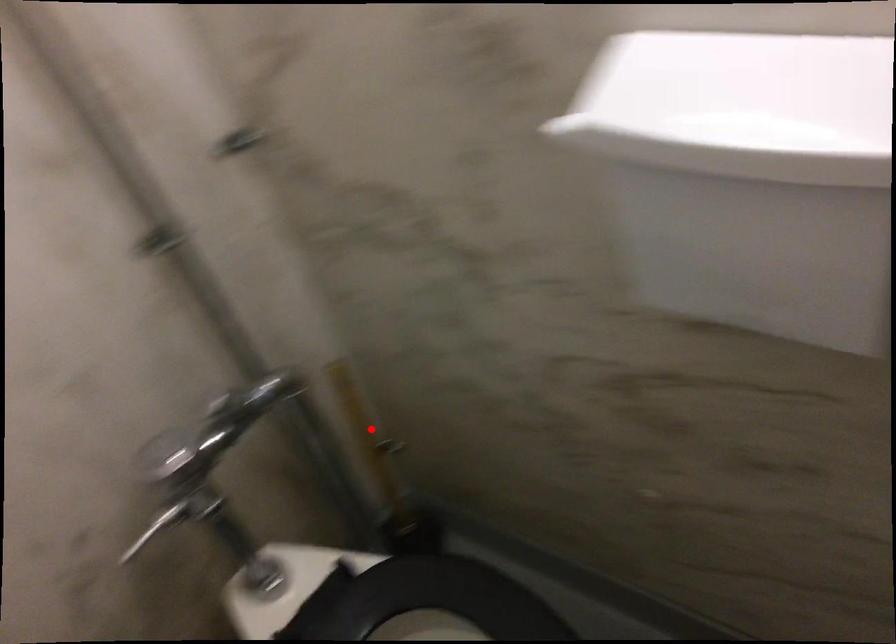
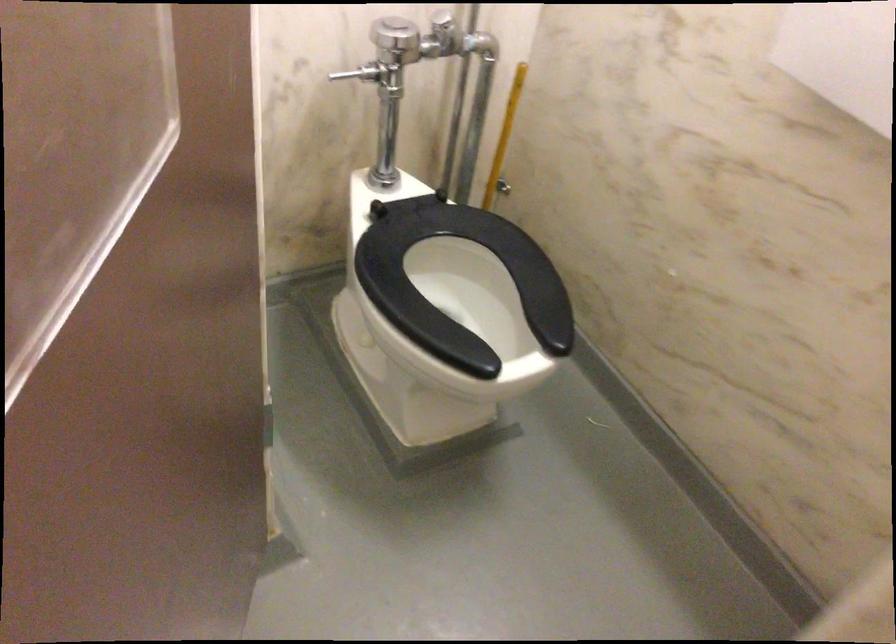
Question: A red point is marked in image1. In image2, is the corresponding 3D point closer to the camera or farther? Reply with the corresponding letter.

Choices:
 (A) The corresponding 3D point is closer.
 (B) The corresponding 3D point is farther.

Answer: (B)